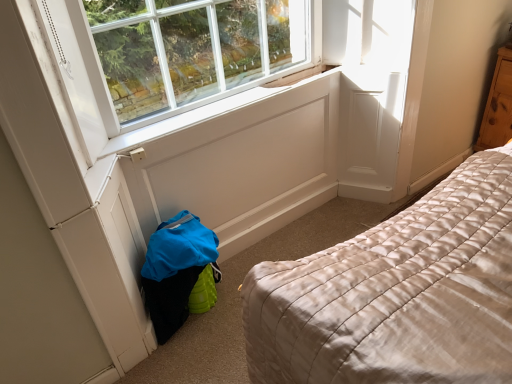
Identify the location of free space above white painted wood at center (from a real-world perspective). Image resolution: width=512 pixels, height=384 pixels. (213, 109).